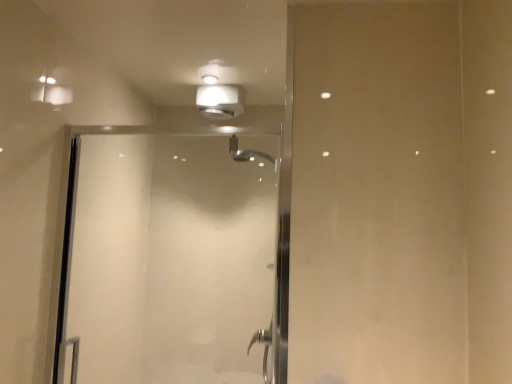
Question: In terms of height, does matte white light fixture at upper center look taller or shorter compared to transparent glass shower door at center?

Choices:
 (A) tall
 (B) short

Answer: (B)

Question: Based on their positions, is matte white light fixture at upper center located to the left or right of transparent glass shower door at center?

Choices:
 (A) left
 (B) right

Answer: (B)

Question: Is matte white light fixture at upper center inside the boundaries of transparent glass shower door at center, or outside?

Choices:
 (A) inside
 (B) outside

Answer: (B)

Question: From the image's perspective, is transparent glass shower door at center located above or below matte white light fixture at upper center?

Choices:
 (A) below
 (B) above

Answer: (A)

Question: From their relative heights in the image, would you say transparent glass shower door at center is taller or shorter than matte white light fixture at upper center?

Choices:
 (A) tall
 (B) short

Answer: (A)

Question: Looking at their shapes, would you say transparent glass shower door at center is wider or thinner than matte white light fixture at upper center?

Choices:
 (A) wide
 (B) thin

Answer: (B)

Question: From a real-world perspective, is transparent glass shower door at center physically located above or below matte white light fixture at upper center?

Choices:
 (A) below
 (B) above

Answer: (A)